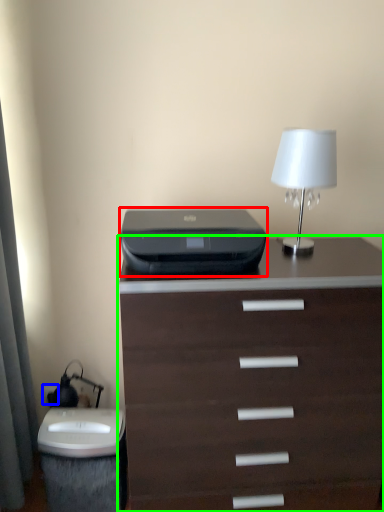
Question: Based on their relative distances, which object is farther from printer (highlighted by a red box)? Choose from electric outlet (highlighted by a blue box) and chest of drawers (highlighted by a green box).

Choices:
 (A) electric outlet
 (B) chest of drawers

Answer: (A)